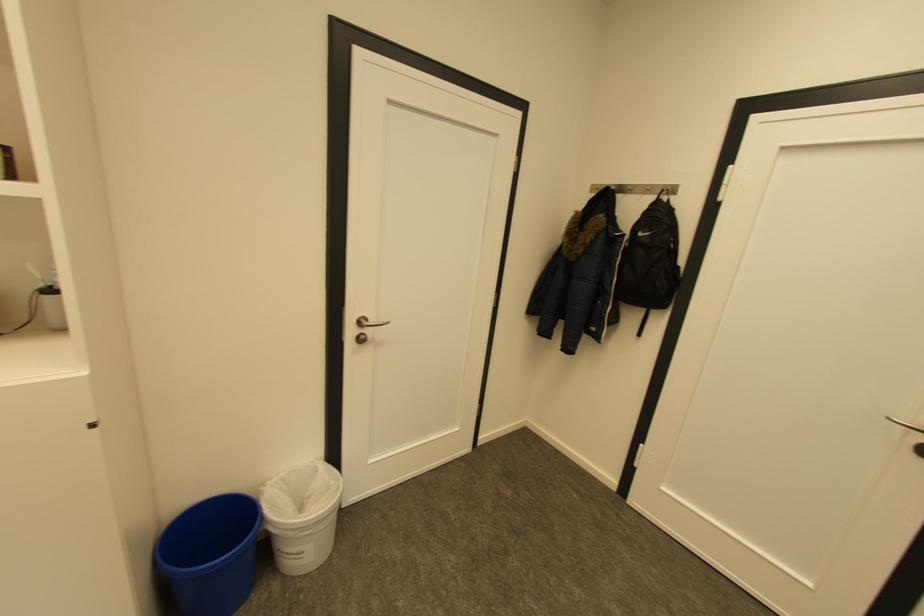
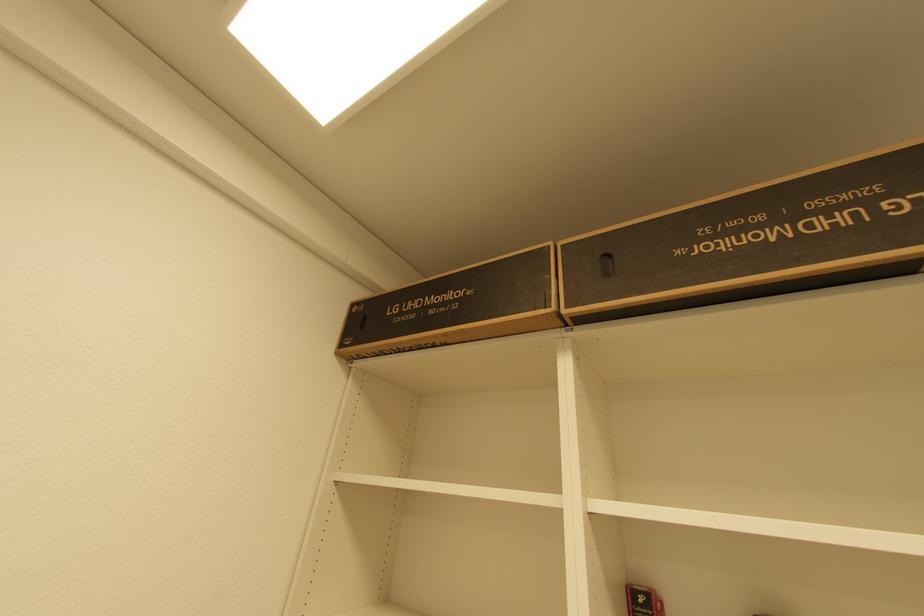
Based on the continuous images, in which direction is the camera rotating?

The camera rotated toward left-up.